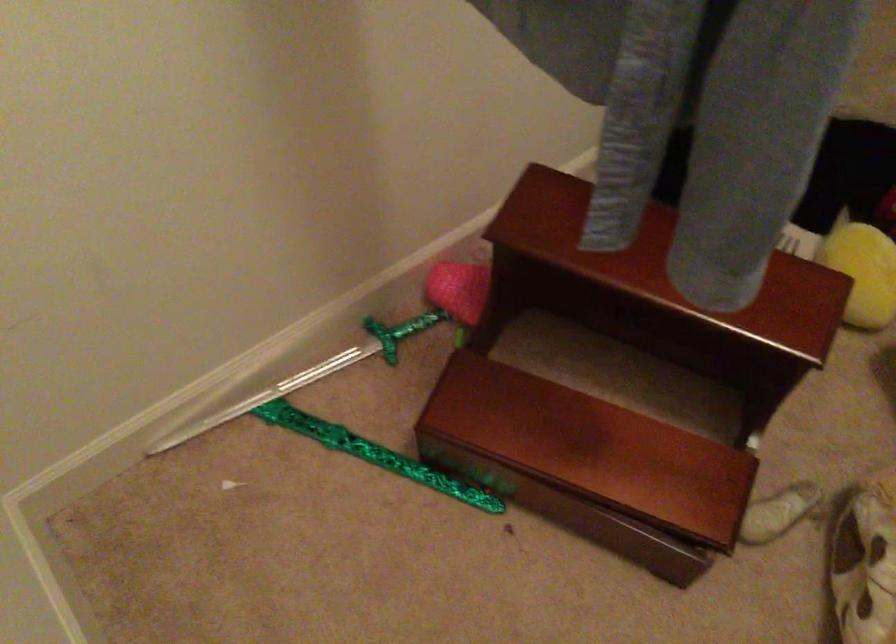
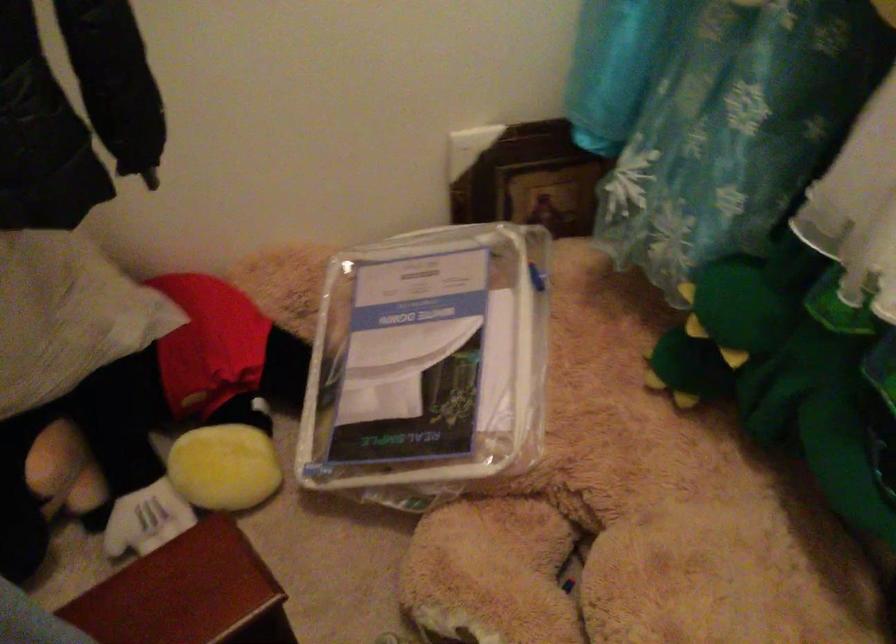
Question: Based on the continuous images, in which direction is the camera rotating? Reply with the corresponding letter.

Choices:
 (A) Left
 (B) Right
 (C) Up
 (D) Down

Answer: (B)